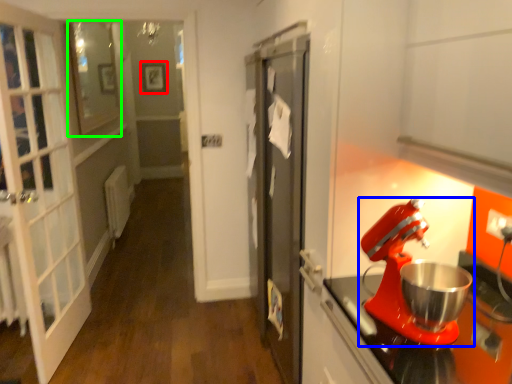
Question: Considering the real-world distances, which object is farthest from picture frame (highlighted by a red box)? mixer (highlighted by a blue box) or window (highlighted by a green box)?

Choices:
 (A) mixer
 (B) window

Answer: (A)